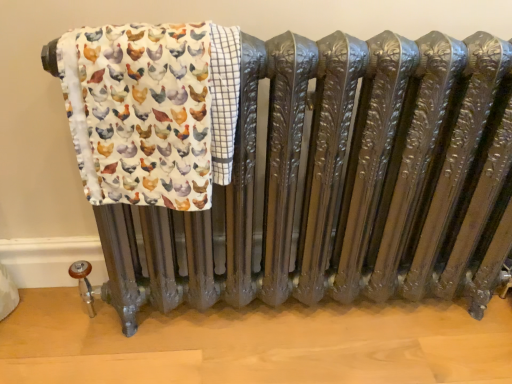
This screenshot has width=512, height=384. In order to click on vacant area on top of white fabric with chicken print at center (from a real-world perspective) in this screenshot , I will do `click(155, 30)`.